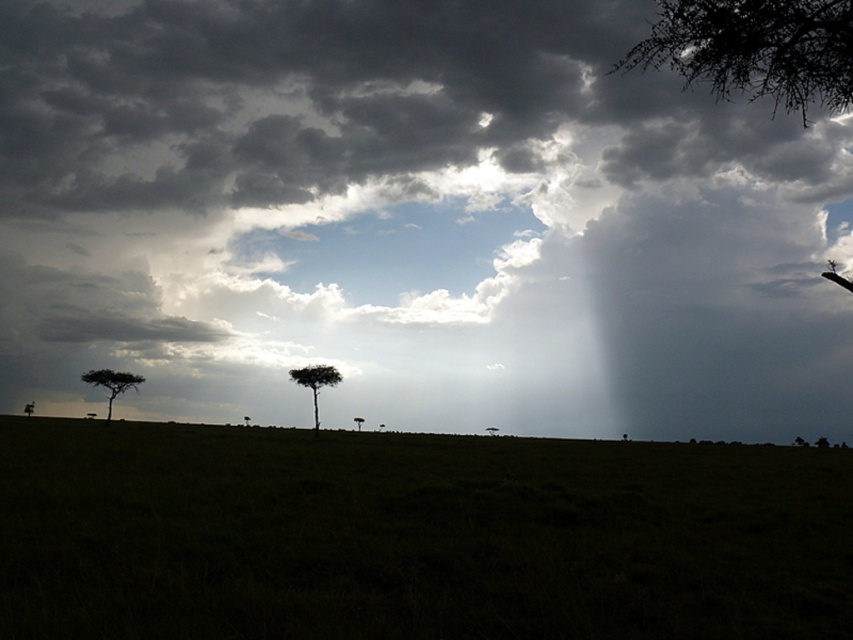
You are an airplane pilot flying at a certain altitude. You notice a dark gray cloud at upper center and a silhouette leafy tree at lower left in the distance. Which object would appear larger in your view? Explain your reasoning based on their positions relative to you.

The dark gray cloud at upper center appears larger because it is closer to the viewer than the silhouette leafy tree at lower left. Objects closer to the observer generally appear larger in size due to perspective.

You are an airplane pilot preparing for takeoff. You notice the dark gray cloud at upper center and the silhouette leafy tree at lower left in the distance. Based on their sizes, which one might pose a greater risk to your flight path?

The dark gray cloud at upper center poses a greater risk to the flight path because it has a larger size compared to the silhouette leafy tree at lower left, making it more likely to cause turbulence or weather disturbances.